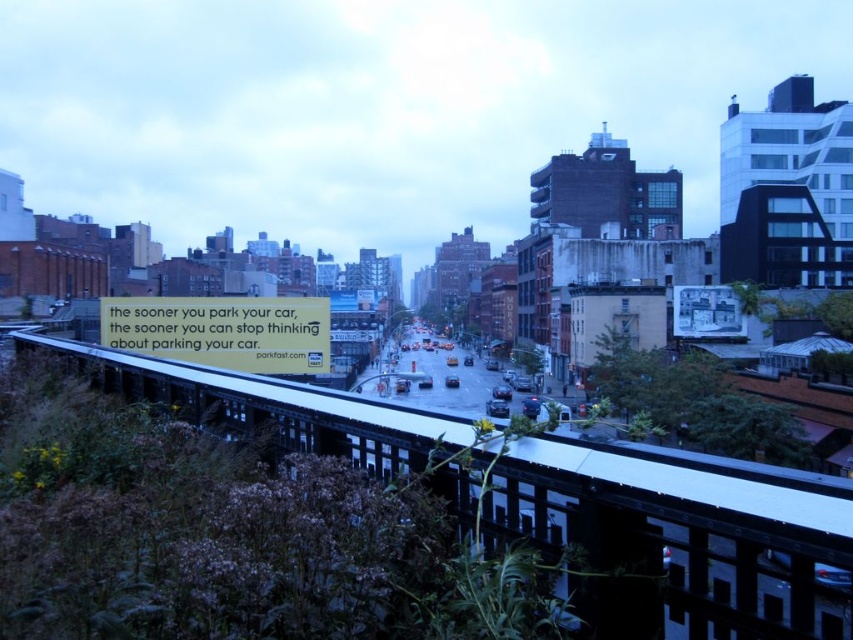
You are a delivery robot that needs to cross the street to reach the black metal train track at center. The road is 23.14 meters wide. Can you cross safely if your maximum travel distance is 25 meters?

The black metal train track at center is 23.14 meters away. Since your maximum travel distance is 25 meters, you can safely cross the road to reach it.

You are a city planner reviewing this area and need to install a new traffic light. The traffic light must be placed between the black metal train track at center and the yellow paper sign at center. Given their sizes, which object should the traffic light be closer to?

The black metal train track at center is larger in size than the yellow paper sign at center, so the traffic light should be placed closer to the yellow paper sign at center to ensure visibility and safety.